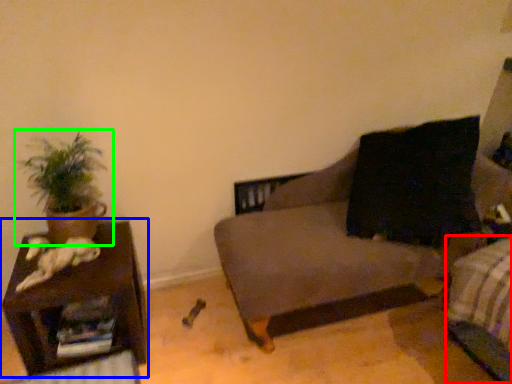
Question: Estimate the real-world distances between objects in this image. Which object is closer to bed frame (highlighted by a red box), furniture (highlighted by a blue box) or houseplant (highlighted by a green box)?

Choices:
 (A) furniture
 (B) houseplant

Answer: (A)